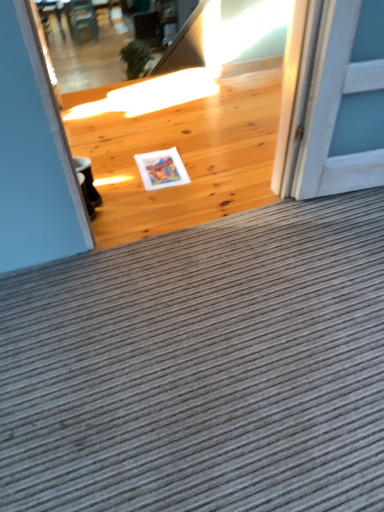
The width and height of the screenshot is (384, 512). I want to click on white matte postcard at center, so click(161, 169).

Is gray corduroy doormat at center turned away from white matte postcard at center?

No, white matte postcard at center is not at the back of gray corduroy doormat at center.

Is gray corduroy doormat at center in front of or behind white matte postcard at center in the image?

Visually, gray corduroy doormat at center is located in front of white matte postcard at center.

Locate an element on the screen. This screenshot has height=512, width=384. hardwood that appears below the wooden chair at upper left (from the image's perspective) is located at coordinates (184, 158).

How many degrees apart are the facing directions of wooden chair at upper left and natural wood floor at center?

They differ by 172 degrees in their facing directions.

From a real-world perspective, is wooden chair at upper left on top of natural wood floor at center?

No.

Is wooden chair at upper left surrounding natural wood floor at center?

No.

Considering the positions of objects wooden chair at upper left and gray corduroy doormat at center in the image provided, who is more to the right, wooden chair at upper left or gray corduroy doormat at center?

gray corduroy doormat at center.

Is wooden chair at upper left facing towards gray corduroy doormat at center?

No, wooden chair at upper left is not turned towards gray corduroy doormat at center.

Which of these two, wooden chair at upper left or gray corduroy doormat at center, stands shorter?

gray corduroy doormat at center.

Is point (92, 19) in front of point (164, 313)?

No, (92, 19) is behind (164, 313).

Could you tell me if gray corduroy doormat at center is facing natural wood floor at center?

Yes, gray corduroy doormat at center is turned towards natural wood floor at center.

From a real-world perspective, is gray corduroy doormat at center above or below natural wood floor at center?

Clearly, from a real-world perspective, gray corduroy doormat at center is below natural wood floor at center.

From the image's perspective, which is above, gray corduroy doormat at center or natural wood floor at center?

natural wood floor at center is shown above in the image.

Looking at this image, is gray corduroy doormat at center to the left of natural wood floor at center from the viewer's perspective?

No.

Which object is wider, gray corduroy doormat at center or wooden chair at upper left?

Wider between the two is gray corduroy doormat at center.

How different are the orientations of gray corduroy doormat at center and wooden chair at upper left in degrees?

They differ by 7.66 degrees in their facing directions.

Is point (336, 480) less distant than point (77, 28)?

Yes.

Is gray corduroy doormat at center closer to camera compared to wooden chair at upper left?

That is True.

Which of these two, natural wood floor at center or wooden chair at upper left, is wider?

Wider between the two is wooden chair at upper left.

Is natural wood floor at center inside or outside of wooden chair at upper left?

natural wood floor at center cannot be found inside wooden chair at upper left.

From the image's perspective, which one is positioned lower, natural wood floor at center or wooden chair at upper left?

From the image's view, natural wood floor at center is below.

Considering the relative sizes of wooden chair at upper left and white matte postcard at center in the image provided, is wooden chair at upper left wider than white matte postcard at center?

Yes, wooden chair at upper left is wider than white matte postcard at center.

Based on the photo, can we say wooden chair at upper left lies outside white matte postcard at center?

wooden chair at upper left is positioned outside white matte postcard at center.

Is wooden chair at upper left turned away from white matte postcard at center?

Yes, wooden chair at upper left's orientation is away from white matte postcard at center.

You are a GUI agent. You are given a task and a screenshot of the screen. Output one action in this format:
    pyautogui.click(x=<x>, y=<y>)
    Task: Click on the postcard located underneath the gray corduroy doormat at center (from a real-world perspective)
    
    Given the screenshot: What is the action you would take?
    tap(161, 169)

Locate an element on the screen. The width and height of the screenshot is (384, 512). hardwood in front of the wooden chair at upper left is located at coordinates (184, 158).

Looking at the image, which one is located closer to natural wood floor at center, wooden chair at upper left or white matte postcard at center?

The object closer to natural wood floor at center is white matte postcard at center.

Looking at the image, which one is located further to natural wood floor at center, gray corduroy doormat at center or white matte postcard at center?

gray corduroy doormat at center lies further to natural wood floor at center than the other object.

Which object lies further to the anchor point white matte postcard at center, natural wood floor at center or gray corduroy doormat at center?

gray corduroy doormat at center is positioned further to the anchor white matte postcard at center.

When comparing their distances from gray corduroy doormat at center, does natural wood floor at center or wooden chair at upper left seem further?

Based on the image, wooden chair at upper left appears to be further to gray corduroy doormat at center.

Based on their spatial positions, is wooden chair at upper left or white matte postcard at center closer to gray corduroy doormat at center?

white matte postcard at center.

Considering their positions, is wooden chair at upper left positioned further to white matte postcard at center than natural wood floor at center?

Based on the image, wooden chair at upper left appears to be further to white matte postcard at center.

Which object lies further to the anchor point wooden chair at upper left, gray corduroy doormat at center or white matte postcard at center?

gray corduroy doormat at center lies further to wooden chair at upper left than the other object.

Considering their positions, is wooden chair at upper left positioned closer to white matte postcard at center than gray corduroy doormat at center?

Among the two, gray corduroy doormat at center is located nearer to white matte postcard at center.

What are the coordinates of `hardwood between gray corduroy doormat at center and white matte postcard at center in the front-back direction` in the screenshot? It's located at (184, 158).

The width and height of the screenshot is (384, 512). I want to click on postcard between natural wood floor at center and wooden chair at upper left from front to back, so click(x=161, y=169).

Find the location of a particular element. postcard positioned between gray corduroy doormat at center and wooden chair at upper left from near to far is located at coordinates (161, 169).

The height and width of the screenshot is (512, 384). Identify the location of hardwood between gray corduroy doormat at center and wooden chair at upper left along the z-axis. (184, 158).